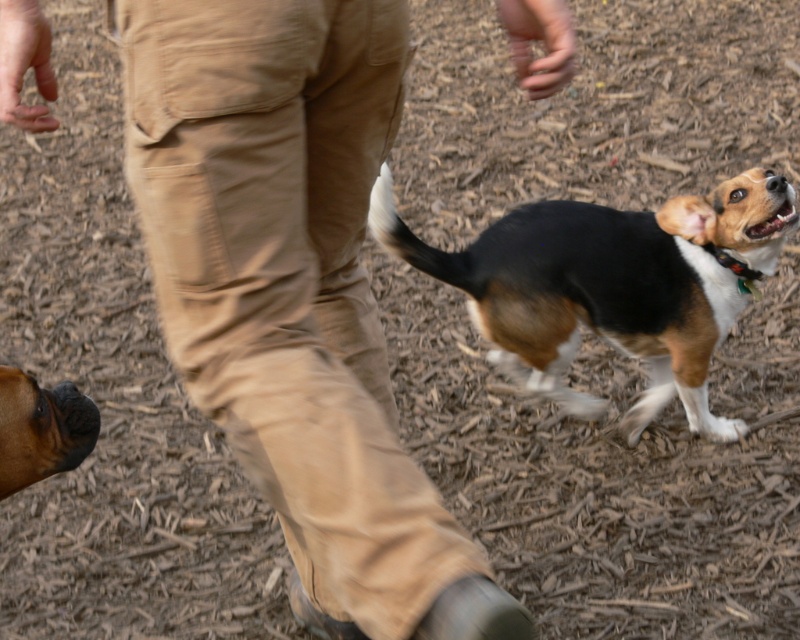
Question: Which object is farther from the camera taking this photo?

Choices:
 (A) black and tan fur dog at center
 (B) tan/cotton pants at center

Answer: (A)

Question: Estimate the real-world distances between objects in this image. Which object is closer to the brown glossy dog at lower left?

Choices:
 (A) tan/cotton pants at center
 (B) black and tan fur dog at center

Answer: (A)

Question: Is tan/cotton pants at center smaller than black and tan fur dog at center?

Choices:
 (A) no
 (B) yes

Answer: (A)

Question: Is tan/cotton pants at center below brown glossy dog at lower left?

Choices:
 (A) yes
 (B) no

Answer: (B)

Question: Which point is farther to the camera?

Choices:
 (A) black and tan fur dog at center
 (B) brown glossy dog at lower left
 (C) tan/cotton pants at center

Answer: (A)

Question: Is tan/cotton pants at center in front of brown glossy dog at lower left?

Choices:
 (A) no
 (B) yes

Answer: (B)